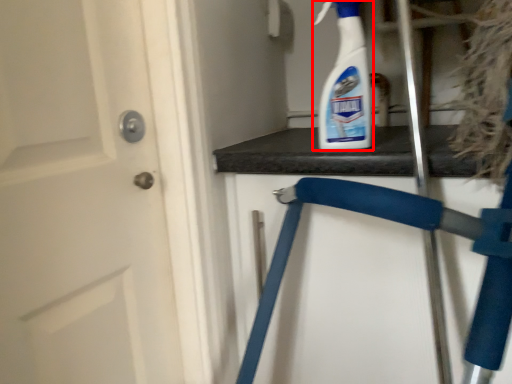
Question: Observing the image, what is the correct spatial positioning of cleaning product (annotated by the red box) in reference to folding chair?

Choices:
 (A) left
 (B) right

Answer: (A)